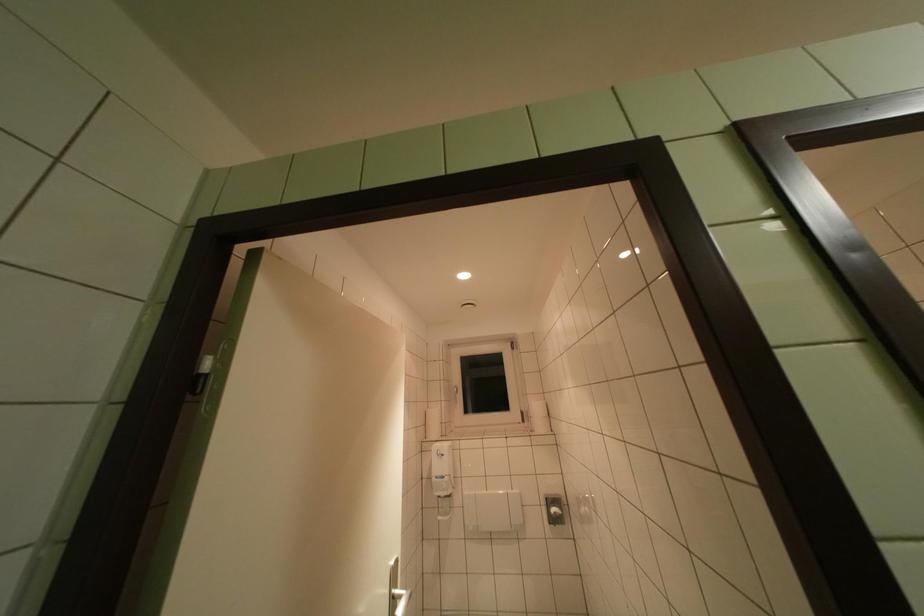
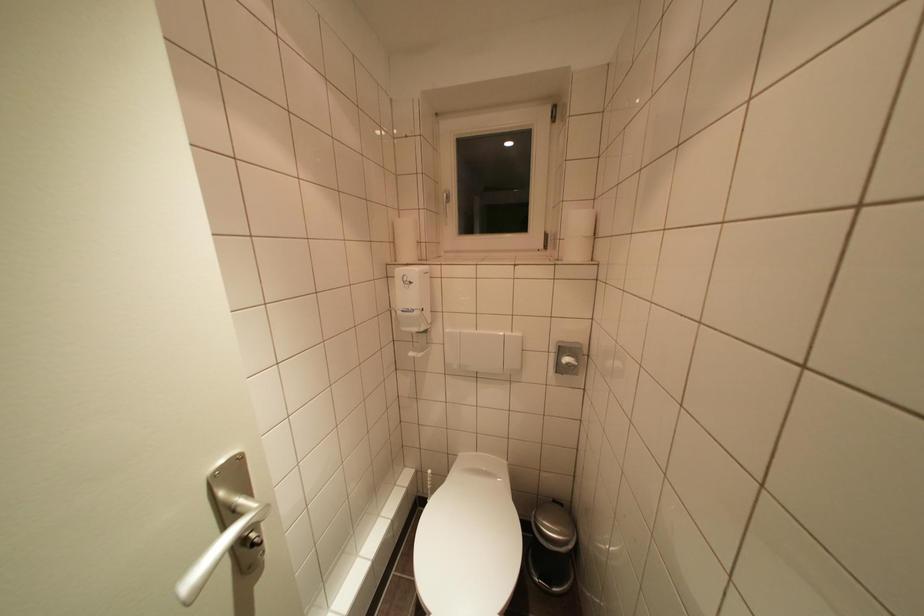
The point at (545, 428) is marked in the first image. Where is the corresponding point in the second image?

(580, 252)